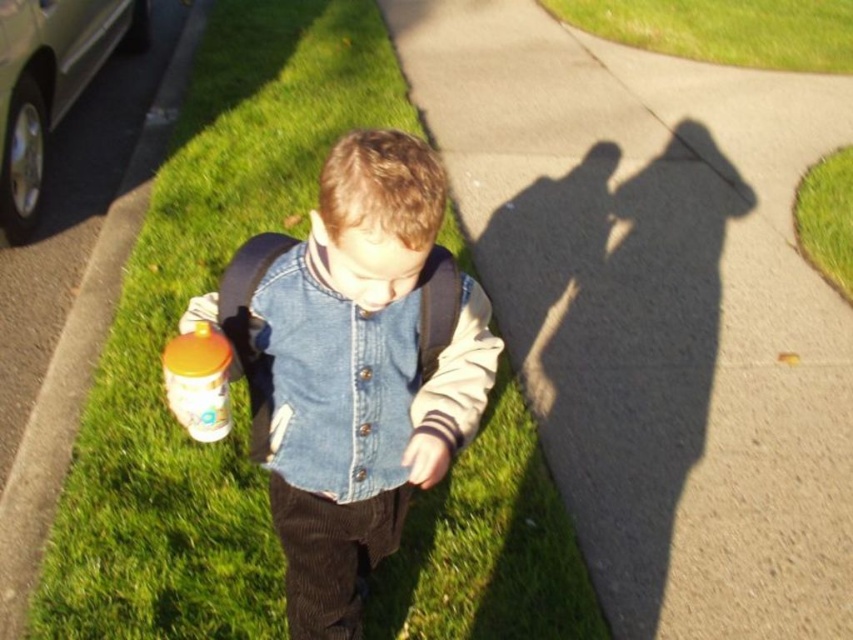
From the picture: You are standing at the point labeled point (76, 12) and want to walk to point (595, 8). Which direction should you face to walk directly towards your destination?

Since point (76, 12) is closer to the viewer than point (595, 8), you should face away from the viewer to walk directly towards point (595, 8).

From the picture: You are a delivery robot that needs to travel from the silver metallic car at upper left to the green grass at upper right. Can you pass through the area between them?

The silver metallic car at upper left has a lesser width compared to green grass at upper right, so the delivery robot can pass through the area between them.

You are standing at the point labeled point [30,180]. You want to walk to the boy in the scene. Which direction should you go?

The point labeled point [30,180] is 12.91 feet away from the viewer. To reach the boy, you should walk towards the direction of the boy who is in front of you since the point is behind you.